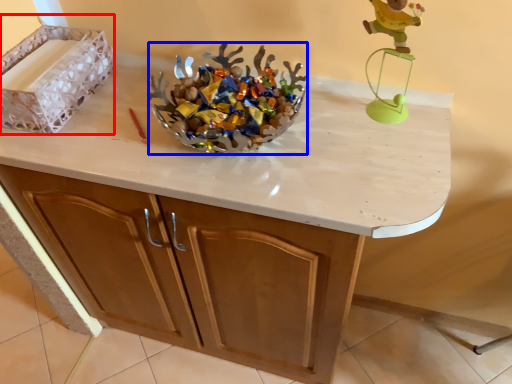
Question: Which point is further to the camera, crate (highlighted by a red box) or stuff (highlighted by a blue box)?

Choices:
 (A) crate
 (B) stuff

Answer: (A)